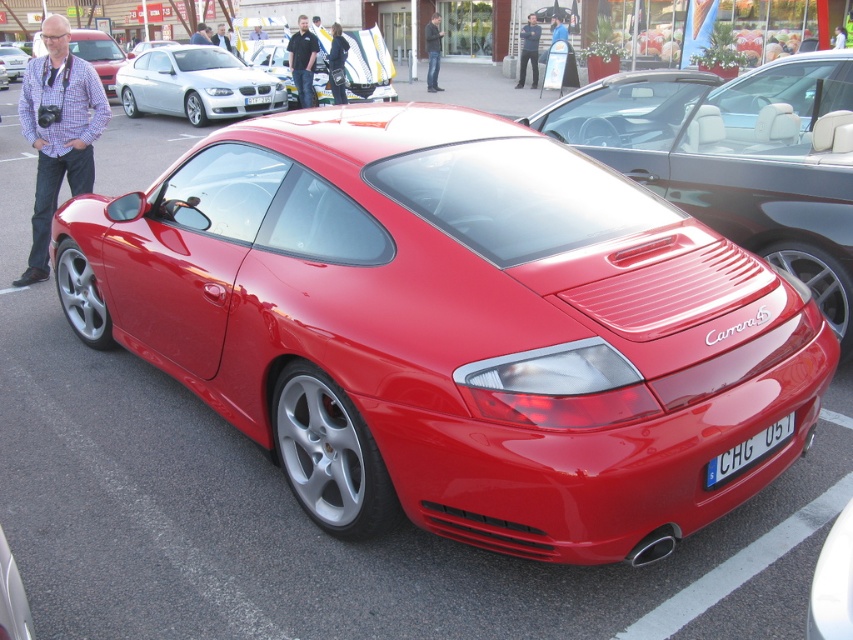
Question: Is the position of shiny metallic red sports car at center more distant than that of blue metallic license plate at rear?

Choices:
 (A) yes
 (B) no

Answer: (B)

Question: Estimate the real-world distances between objects in this image. Which object is closer to the sleek silver coupe at upper left?

Choices:
 (A) matte black car at left
 (B) shiny metallic red sports car at center
 (C) blue metallic license plate at rear

Answer: (B)

Question: Which of the following is the closest to the observer?

Choices:
 (A) blue metallic license plate at rear
 (B) glossy red porsche at center
 (C) sleek silver coupe at upper left

Answer: (A)

Question: Which point is farther to the camera?

Choices:
 (A) coord(9,61)
 (B) coord(726,113)

Answer: (A)

Question: Can you confirm if glossy red porsche at center is wider than blue metallic license plate at rear?

Choices:
 (A) no
 (B) yes

Answer: (B)

Question: Can you confirm if glossy red porsche at center is positioned to the right of sleek silver coupe at upper left?

Choices:
 (A) yes
 (B) no

Answer: (A)